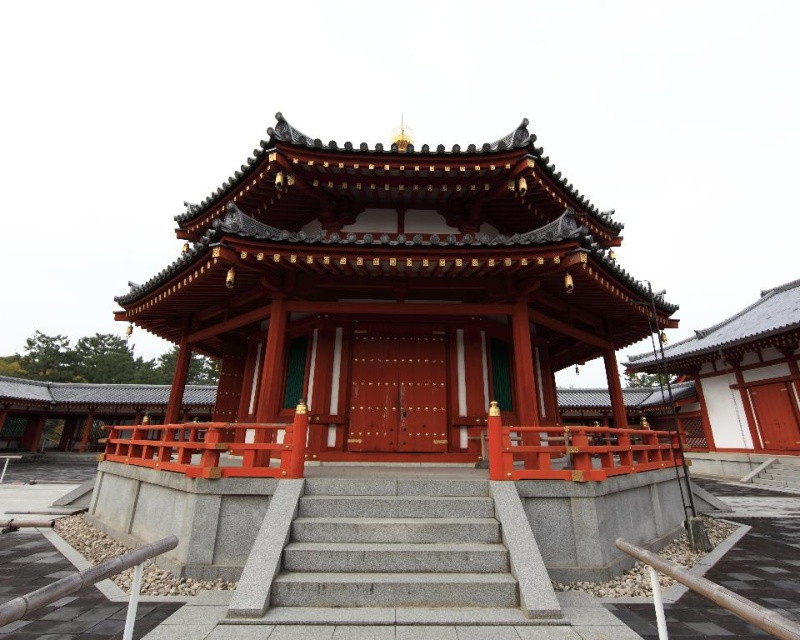
You are a visitor at the pavilion and want to sit on the railing. Which one is larger and more suitable for sitting between the smooth wood railing at center and the smooth glossy wood rail at center?

The smooth wood railing at center is bigger than the smooth glossy wood rail at center, so it is more suitable for sitting.

You are standing at the base of the gray granite stairs at center and want to reach the smooth wood railing at center. Which direction should you move to get closer to the railing?

The gray granite stairs at center is above the smooth wood railing at center, so you should move upward to get closer to the smooth wood railing at center.